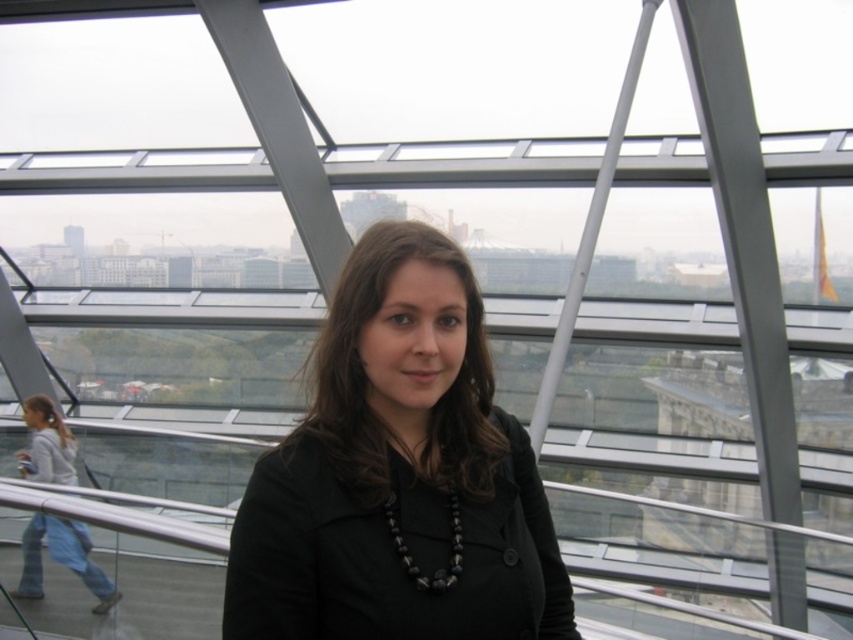
Between point (302, 420) and point (32, 461), which one is positioned behind?

Positioned behind is point (32, 461).

Is black matte jacket at center to the right of light blue jeans at lower left from the viewer's perspective?

Yes, black matte jacket at center is to the right of light blue jeans at lower left.

Is point (363, 387) positioned behind point (39, 563)?

That is False.

Where is `black matte jacket at center`? This screenshot has width=853, height=640. black matte jacket at center is located at coordinates (398, 474).